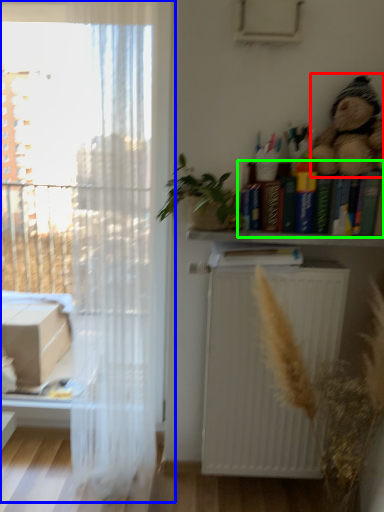
Question: Based on their relative distances, which object is farther from toy (highlighted by a red box)? Choose from window (highlighted by a blue box) and book (highlighted by a green box).

Choices:
 (A) window
 (B) book

Answer: (A)